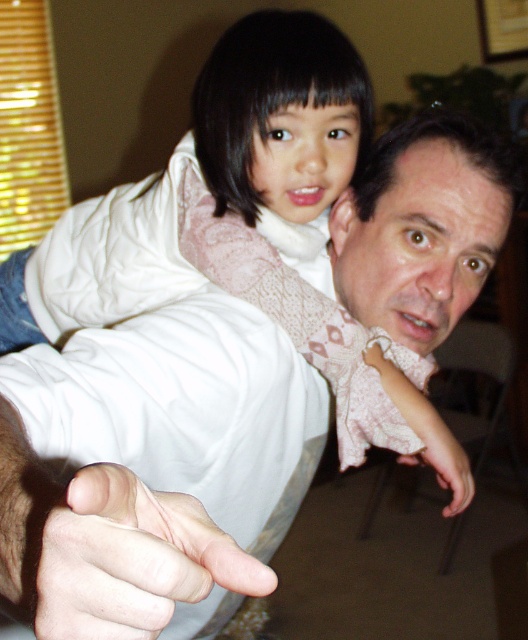
Question: Is white matte hand at center above pink lace sleeve at upper center?

Choices:
 (A) yes
 (B) no

Answer: (A)

Question: Which point appears closest to the camera in this image?

Choices:
 (A) (157, 620)
 (B) (404, 388)

Answer: (A)

Question: Which point is farther to the camera?

Choices:
 (A) pink lace sleeve at upper center
 (B) white matte hand at center

Answer: (A)

Question: Considering the relative positions of white matte hand at center and pink lace sleeve at upper center in the image provided, where is white matte hand at center located with respect to pink lace sleeve at upper center?

Choices:
 (A) below
 (B) above

Answer: (B)

Question: Which point appears farthest from the camera in this image?

Choices:
 (A) [163, 611]
 (B) [402, 388]

Answer: (B)

Question: Observing the image, what is the correct spatial positioning of white matte hand at center in reference to pink lace sleeve at upper center?

Choices:
 (A) right
 (B) left

Answer: (B)